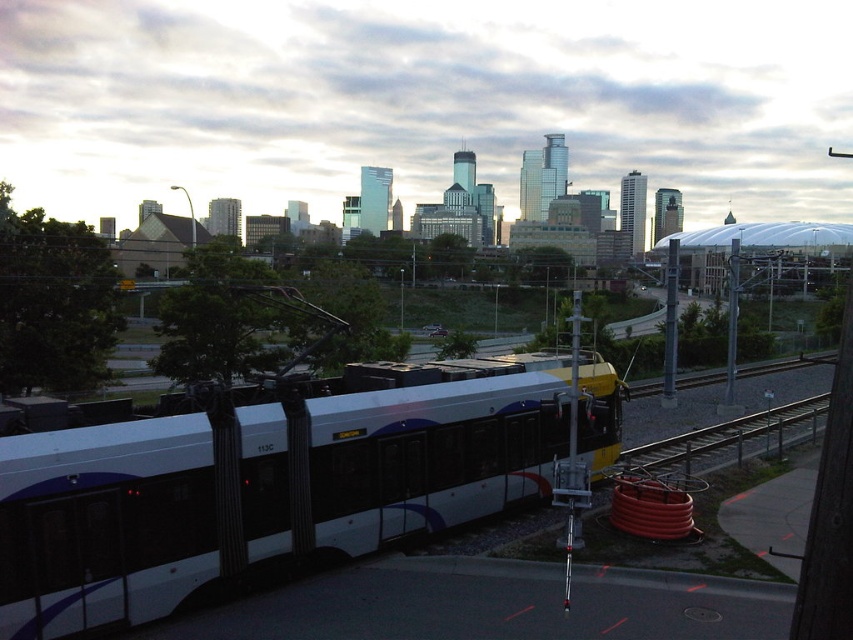
You are standing at the tram marked with number 113C and want to walk towards the point with coordinates point [177,490] and point [650,461]. Which point should you walk towards first to reach both points in the most efficient way?

You should walk towards point [177,490] first because it is in front of point [650,461], so you can reach it without having to go around or backtrack.

You are standing at the point with coordinates (276,477) in the image. What object are you on?

The point (276,477) is on the white glossy passenger train at center.

You are a pedestrian standing at the intersection near the white glossy passenger train at center and the metallic gray train track at lower right. You want to cross the tracks safely. Which object should you look towards first to ensure the train has passed?

You should look towards the white glossy passenger train at center first because it is in front of the metallic gray train track at lower right, meaning it would pass by the tracks before you reach them.